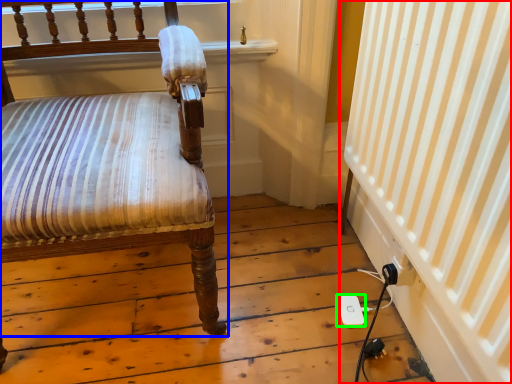
Question: Based on their relative distances, which object is farther from curtain (highlighted by a red box)? Choose from chair (highlighted by a blue box) and ipod (highlighted by a green box).

Choices:
 (A) chair
 (B) ipod

Answer: (A)